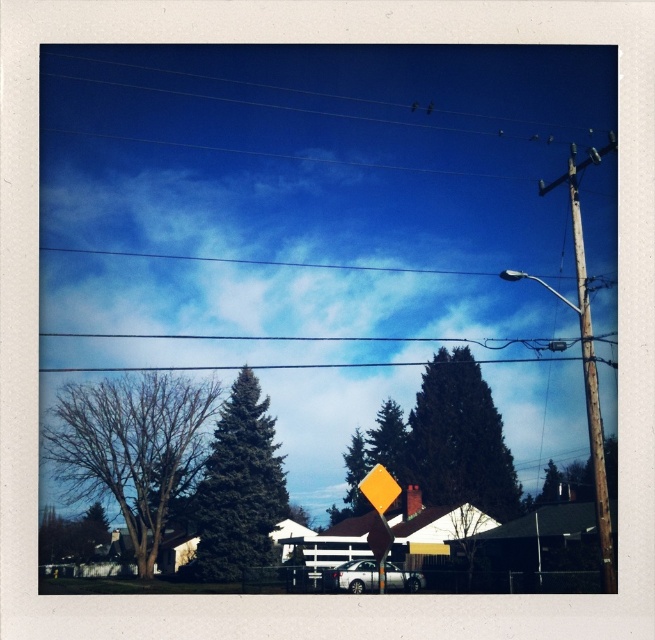
Question: Does dark green textured tree at center appear over green matte evergreen tree at center?

Choices:
 (A) yes
 (B) no

Answer: (A)

Question: Can you confirm if bare branches at left is positioned above weathered wood telegraph pole at right?

Choices:
 (A) no
 (B) yes

Answer: (A)

Question: Does bare branches at left appear on the right side of dark green textured tree at center?

Choices:
 (A) yes
 (B) no

Answer: (B)

Question: Among these points, which one is farthest from the camera?

Choices:
 (A) (132, 440)
 (B) (189, 564)
 (C) (572, 179)
 (D) (447, 420)

Answer: (D)

Question: Which of the following is the closest to the observer?

Choices:
 (A) tap(502, 483)
 (B) tap(176, 458)
 (C) tap(601, 525)
 (D) tap(246, 426)

Answer: (C)

Question: Which object is the closest to the dark green textured tree at center?

Choices:
 (A) green matte evergreen tree at center
 (B) weathered wood telegraph pole at right
 (C) bare branches at left

Answer: (A)